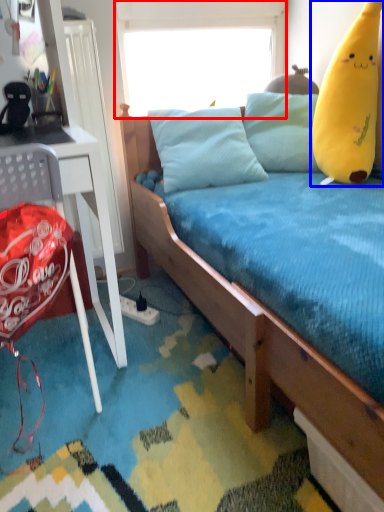
Question: Which object appears farthest to the camera in this image, window screen (highlighted by a red box) or toy (highlighted by a blue box)?

Choices:
 (A) window screen
 (B) toy

Answer: (A)